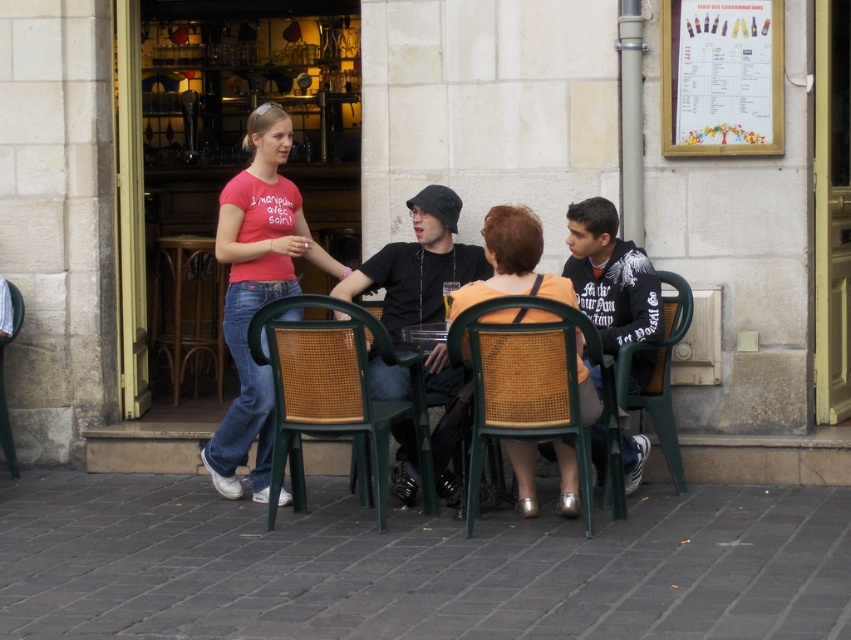
Question: Is green cane chair at center to the right of green plastic chair at lower right from the viewer's perspective?

Choices:
 (A) yes
 (B) no

Answer: (B)

Question: Which of the following is the farthest from the observer?

Choices:
 (A) matte pink t-shirt at center
 (B) green cane chair at center

Answer: (A)

Question: Does wooden framed menu at upper right have a lesser width compared to green plastic chair at lower right?

Choices:
 (A) yes
 (B) no

Answer: (B)

Question: Which point is farther to the camera?

Choices:
 (A) (678, 108)
 (B) (545, 355)
 (C) (267, 346)

Answer: (A)

Question: Which object appears closest to the camera in this image?

Choices:
 (A) brown wicker table at left
 (B) green cane chair at center
 (C) green plastic chair at lower left

Answer: (B)

Question: Is the position of wooden framed menu at upper right less distant than that of green plastic chair at lower right?

Choices:
 (A) yes
 (B) no

Answer: (B)